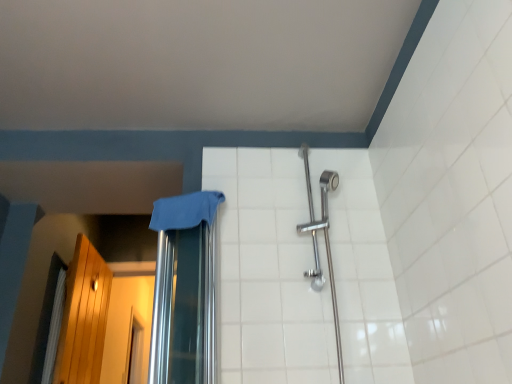
Question: Is white ceramic tile at center bigger or smaller than wooden screen door at left?

Choices:
 (A) small
 (B) big

Answer: (A)

Question: Considering the positions of white ceramic tile at center and wooden screen door at left in the image, is white ceramic tile at center wider or thinner than wooden screen door at left?

Choices:
 (A) thin
 (B) wide

Answer: (A)

Question: Estimate the real-world distances between objects in this image. Which object is closer to the blue fabric at center?

Choices:
 (A) wooden screen door at left
 (B) white fabric shower curtain at left
 (C) white ceramic tile at center

Answer: (C)

Question: Based on their relative distances, which object is farther from the white ceramic tile at center?

Choices:
 (A) white fabric shower curtain at left
 (B) blue fabric at center
 (C) wooden screen door at left

Answer: (C)